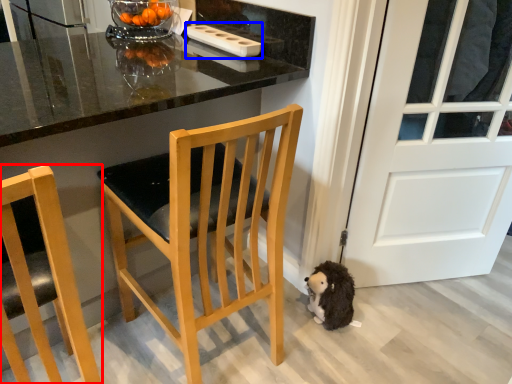
Question: Which object is closer to the camera taking this photo, chair (highlighted by a red box) or appliance (highlighted by a blue box)?

Choices:
 (A) chair
 (B) appliance

Answer: (A)